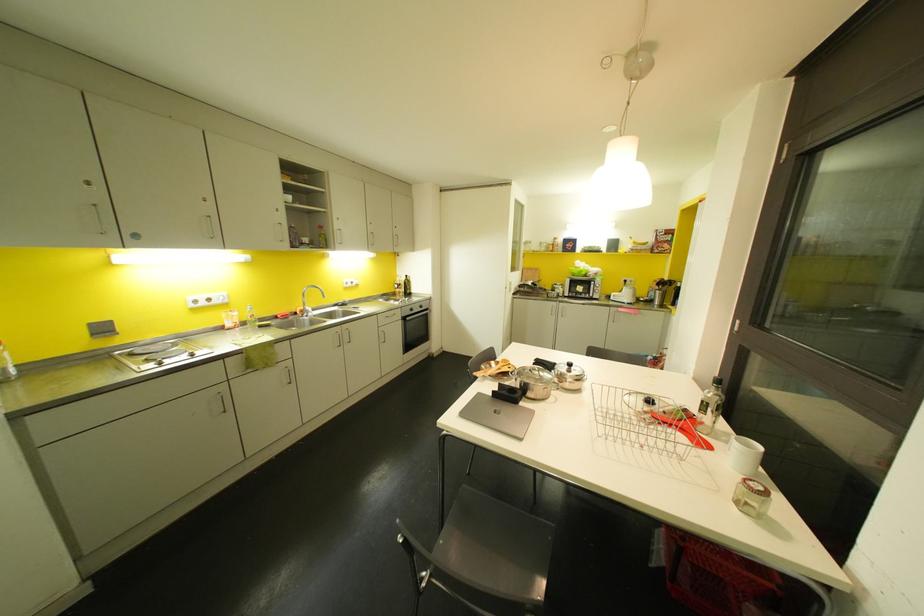
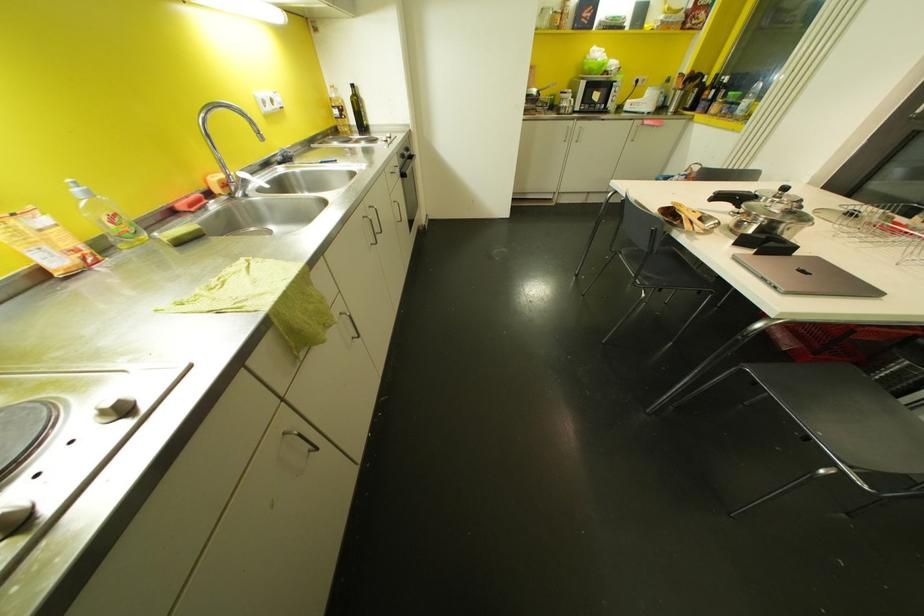
Where in the second image is the point corresponding to the point at 284,315 from the first image?

(198, 204)